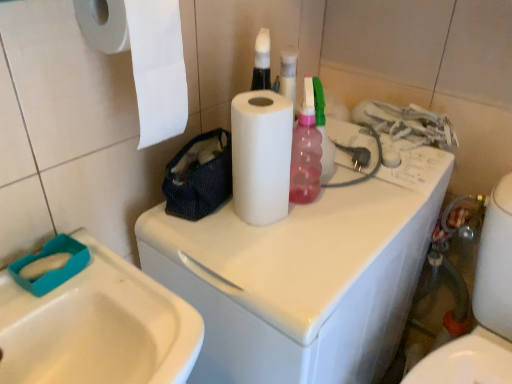
Question: From the image's perspective, relative to white matte paper towel at center, the 2th paper towel viewed from the left, is white paper at upper left, marked as the 2th paper towel in a right-to-left arrangement, above or below?

Choices:
 (A) above
 (B) below

Answer: (A)

Question: Is white paper at upper left, which is the first paper towel in left-to-right order, inside the boundaries of white matte paper towel at center, the 2th paper towel viewed from the left, or outside?

Choices:
 (A) outside
 (B) inside

Answer: (A)

Question: Estimate the real-world distances between objects in this image. Which object is closer to the white paper at upper left, marked as the 2th paper towel in a right-to-left arrangement?

Choices:
 (A) white glossy toilet at lower right
 (B) white glossy washing machine at center
 (C) white glossy sink at lower left
 (D) white matte paper towel at center, the 2th paper towel viewed from the left

Answer: (D)

Question: Considering the real-world distances, which object is closest to the white glossy toilet at lower right?

Choices:
 (A) white glossy washing machine at center
 (B) white matte paper towel at center, which is the first paper towel from right to left
 (C) white paper at upper left, marked as the 2th paper towel in a right-to-left arrangement
 (D) white glossy sink at lower left

Answer: (A)